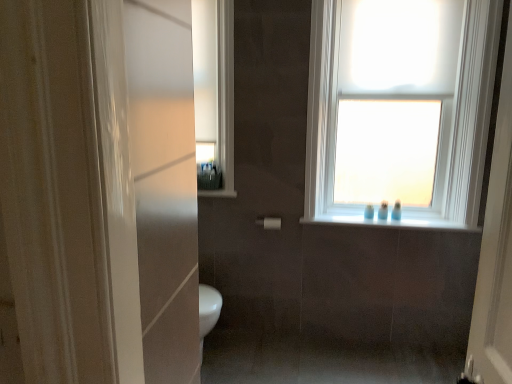
Question: Which direction should I rotate to look at white glossy window sill at upper center, the 1th window sill from the right?

Choices:
 (A) left
 (B) right

Answer: (B)

Question: From a real-world perspective, is white matte towel bar at center on top of white glossy window sill at upper center, placed as the 2th window sill when sorted from bottom to top?

Choices:
 (A) yes
 (B) no

Answer: (B)

Question: Does white matte towel bar at center have a lesser height compared to white glossy window sill at upper center, marked as the 1th window sill in a left-to-right arrangement?

Choices:
 (A) no
 (B) yes

Answer: (A)

Question: Is white matte towel bar at center outside white glossy window sill at upper center, placed as the 2th window sill when sorted from bottom to top?

Choices:
 (A) yes
 (B) no

Answer: (A)

Question: Is white matte towel bar at center not near white glossy window sill at upper center, acting as the second window sill starting from the right?

Choices:
 (A) yes
 (B) no

Answer: (B)

Question: Are white matte towel bar at center and white glossy window sill at upper center, marked as the 1th window sill in a left-to-right arrangement, making contact?

Choices:
 (A) yes
 (B) no

Answer: (B)

Question: Is the position of white matte towel bar at center less distant than that of white glossy window sill at upper center, marked as the 1th window sill in a top-to-bottom arrangement?

Choices:
 (A) yes
 (B) no

Answer: (A)

Question: Is blue plastic toothbrushes at window, which appears as the second toiletry when viewed from the right, not near white matte towel bar at center?

Choices:
 (A) no
 (B) yes

Answer: (A)

Question: From the image's perspective, is blue plastic toothbrushes at window, which appears as the second toiletry when viewed from the right, over white matte towel bar at center?

Choices:
 (A) no
 (B) yes

Answer: (B)

Question: From a real-world perspective, is blue plastic toothbrushes at window, which appears as the second toiletry when viewed from the right, located beneath white matte towel bar at center?

Choices:
 (A) yes
 (B) no

Answer: (B)

Question: Is blue plastic toothbrushes at window, which appears as the third toiletry when viewed from the left, smaller than white matte towel bar at center?

Choices:
 (A) no
 (B) yes

Answer: (B)

Question: Are blue plastic toothbrushes at window, which appears as the third toiletry when viewed from the left, and white matte towel bar at center beside each other?

Choices:
 (A) yes
 (B) no

Answer: (B)

Question: Is blue plastic toothbrushes at window, which appears as the second toiletry when viewed from the right, turned away from white matte towel bar at center?

Choices:
 (A) no
 (B) yes

Answer: (A)

Question: Does white glossy window sill at upper center, placed as the 2th window sill when sorted from bottom to top, appear on the left side of white glossy window sill at upper center, which is the second window sill from left to right?

Choices:
 (A) no
 (B) yes

Answer: (B)